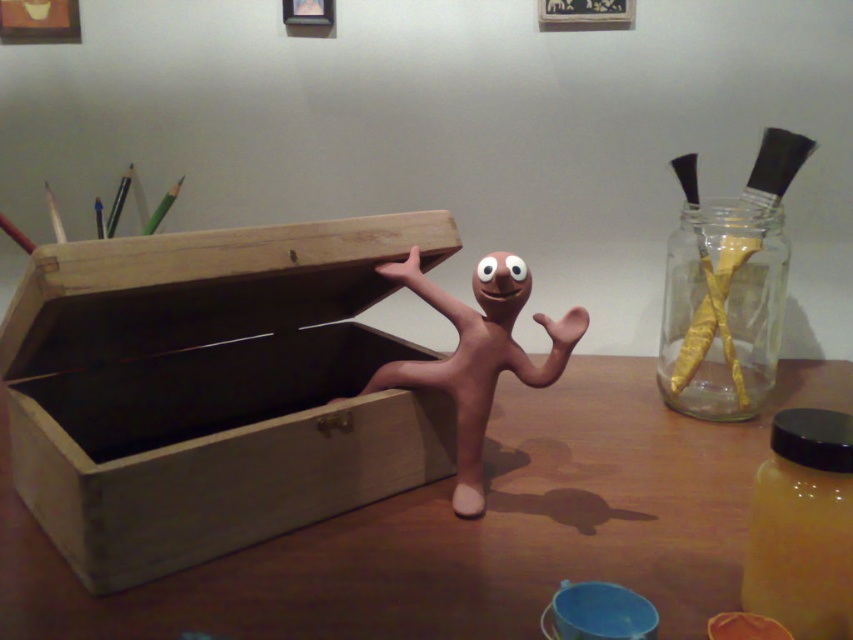
Question: Is wooden box at center thinner than matte clay figure at center?

Choices:
 (A) no
 (B) yes

Answer: (A)

Question: Can you confirm if wooden box at center is wider than gold foil wrapped at right?

Choices:
 (A) no
 (B) yes

Answer: (B)

Question: Which point appears farthest from the camera in this image?

Choices:
 (A) [157, 538]
 (B) [577, 504]
 (C) [508, 316]
 (D) [737, 310]

Answer: (D)

Question: Which is farther from the wooden box at center?

Choices:
 (A) matte clay figure at center
 (B) brown wooden table at center

Answer: (B)

Question: Which point is farther to the camera?

Choices:
 (A) (73, 474)
 (B) (491, 282)

Answer: (B)

Question: Does gold foil wrapped at right have a lesser width compared to matte clay figure at center?

Choices:
 (A) no
 (B) yes

Answer: (B)